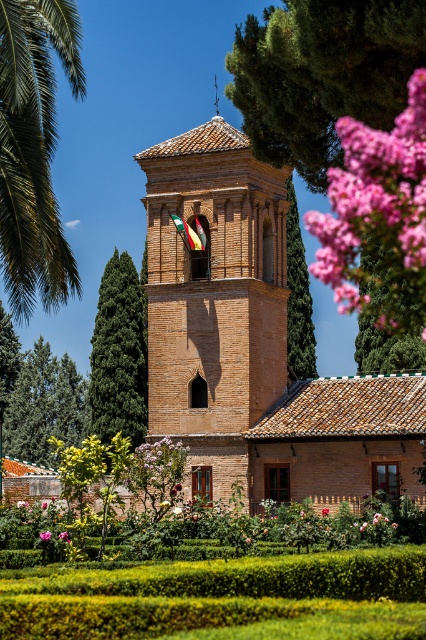
Question: From the image, what is the correct spatial relationship of pink silky petals at upper right in relation to green textured tree at center?

Choices:
 (A) left
 (B) right

Answer: (B)

Question: Based on their relative distances, which object is farther from the pink matte rose at center?

Choices:
 (A) pink petal at upper right
 (B) green leafy tree at upper right

Answer: (B)

Question: Among these objects, which one is nearest to the camera?

Choices:
 (A) green leafy palm at upper left
 (B) brown brick church at center
 (C) pink matte flower at upper right
 (D) green leafy tree at upper right

Answer: (D)

Question: Can you confirm if pink matte flower at upper right is positioned to the right of pink matte rose at center?

Choices:
 (A) no
 (B) yes

Answer: (B)

Question: Can you confirm if green leafy palm at upper left is wider than pink matte flower at center?

Choices:
 (A) no
 (B) yes

Answer: (B)

Question: Which is farther from the brown brick church at center?

Choices:
 (A) pink silky petals at upper right
 (B) pink petal at upper right
 (C) green textured tree at center

Answer: (B)